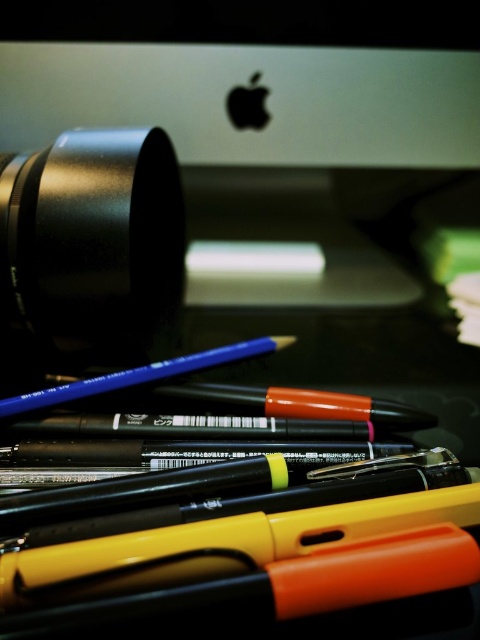
Can you confirm if sleek silver desktop at upper center is positioned to the right of black matte camera lens at upper left?

Yes, sleek silver desktop at upper center is to the right of black matte camera lens at upper left.

Does sleek silver desktop at upper center have a lesser height compared to black matte camera lens at upper left?

Correct, sleek silver desktop at upper center is not as tall as black matte camera lens at upper left.

At what (x,y) coordinates should I click in order to perform the action: click on sleek silver desktop at upper center. Please return your answer as a coordinate pair (x, y). This screenshot has height=640, width=480. Looking at the image, I should click on (251, 77).

Identify the location of sleek silver desktop at upper center. coord(251,77).